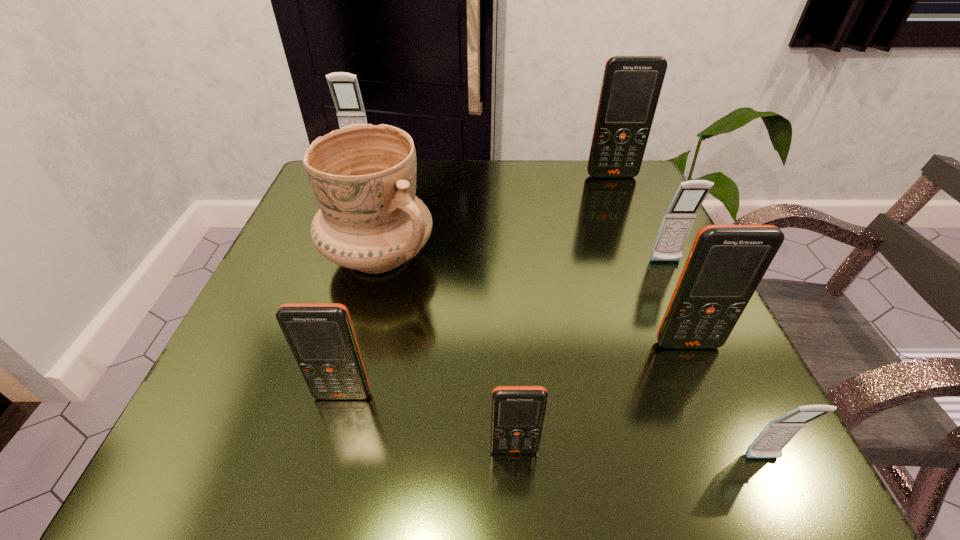
At what (x,y) coordinates should I click in order to perform the action: click on pottery that is at the left edge. Please return your answer as a coordinate pair (x, y). Image resolution: width=960 pixels, height=540 pixels. Looking at the image, I should click on (363, 176).

The height and width of the screenshot is (540, 960). What are the coordinates of `object that is at the far left corner` in the screenshot? It's located at (344, 87).

I want to click on object located at the far right corner, so click(x=631, y=86).

This screenshot has width=960, height=540. Find the location of `object present at the near right corner`. object present at the near right corner is located at coordinates (777, 433).

The height and width of the screenshot is (540, 960). I want to click on free space at the far edge of the desktop, so click(x=565, y=182).

At what (x,y) coordinates should I click in order to perform the action: click on vacant space at the near edge of the desktop. Please return your answer as a coordinate pair (x, y). The image size is (960, 540). Looking at the image, I should click on (645, 446).

In the image, there is a desktop. Where is `vacant area at the right edge`? The height and width of the screenshot is (540, 960). vacant area at the right edge is located at coordinates (618, 292).

The height and width of the screenshot is (540, 960). In the image, there is a desktop. Find the location of `free space at the near left corner`. free space at the near left corner is located at coordinates (273, 413).

Locate an element on the screen. The image size is (960, 540). blank area at the far right corner is located at coordinates (623, 208).

The width and height of the screenshot is (960, 540). What are the coordinates of `empty location between the farthest cellular telephone and the leftmost orange cellular telephone` in the screenshot? It's located at (351, 280).